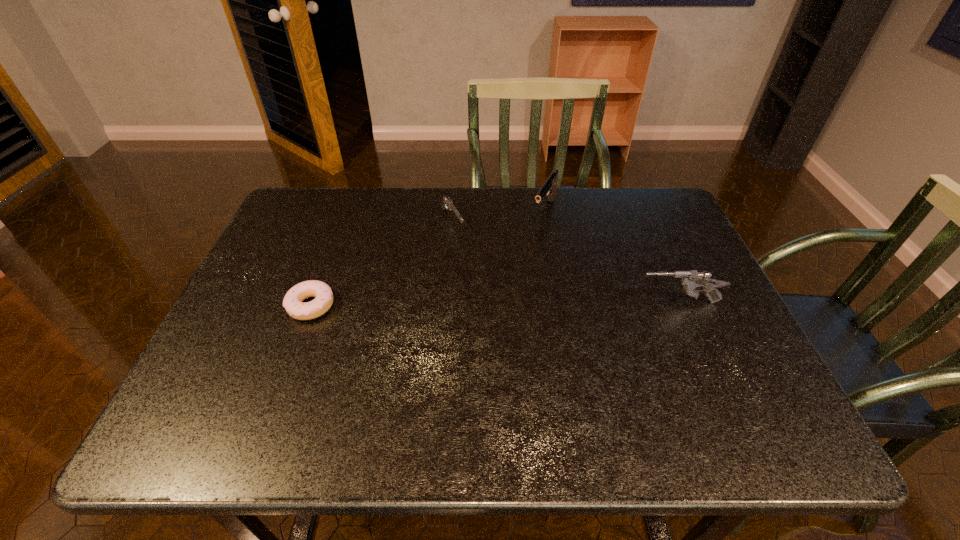
This screenshot has height=540, width=960. Find the location of `the leftmost object`. the leftmost object is located at coordinates (292, 302).

This screenshot has width=960, height=540. In order to click on the shortest object in this screenshot , I will do `click(292, 302)`.

I want to click on the rightmost object, so click(692, 279).

The image size is (960, 540). I want to click on the second shortest object, so click(x=446, y=203).

Where is `the second object from left to right`? Image resolution: width=960 pixels, height=540 pixels. the second object from left to right is located at coordinates (446, 203).

I want to click on the right pistol, so click(549, 188).

Where is `the taller pistol`? This screenshot has width=960, height=540. the taller pistol is located at coordinates (549, 188).

Identify the location of vacant space situated on the back of the shortest object. (337, 236).

The height and width of the screenshot is (540, 960). In order to click on free space located 0.240m at the barrel of the rightmost object in this screenshot , I will do `click(538, 302)`.

Where is `blank space located 0.170m at the barrel of the rightmost object`? blank space located 0.170m at the barrel of the rightmost object is located at coordinates (566, 302).